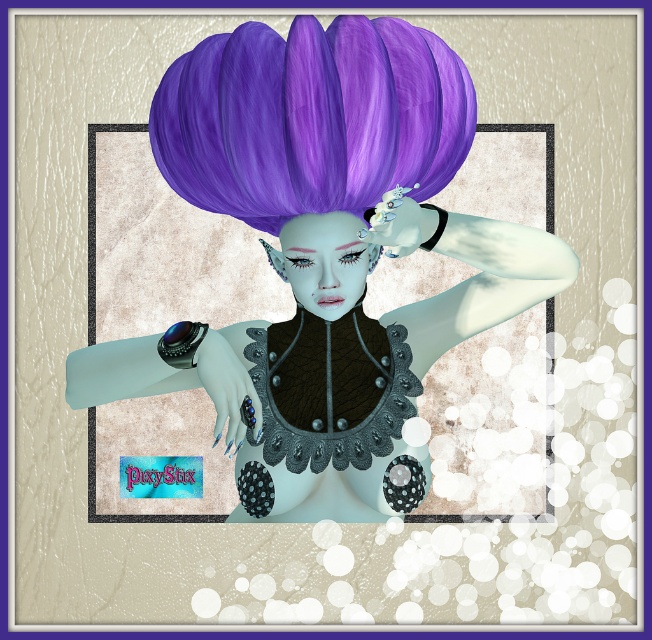
Question: Does purple matte wig at upper center come behind satin black corset at center?

Choices:
 (A) yes
 (B) no

Answer: (B)

Question: Which object is positioned farthest from the matte purple wig at upper center?

Choices:
 (A) purple matte wig at upper center
 (B) satin black corset at center

Answer: (B)

Question: Which point appears closest to the camera in this image?

Choices:
 (A) (141, 426)
 (B) (319, 470)

Answer: (B)

Question: Is matte purple wig at upper center below purple matte wig at upper center?

Choices:
 (A) yes
 (B) no

Answer: (A)

Question: Which object appears farthest from the camera in this image?

Choices:
 (A) satin black corset at center
 (B) matte purple wig at upper center
 (C) purple matte wig at upper center

Answer: (A)

Question: Where is matte purple wig at upper center located in relation to satin black corset at center in the image?

Choices:
 (A) right
 (B) left

Answer: (B)